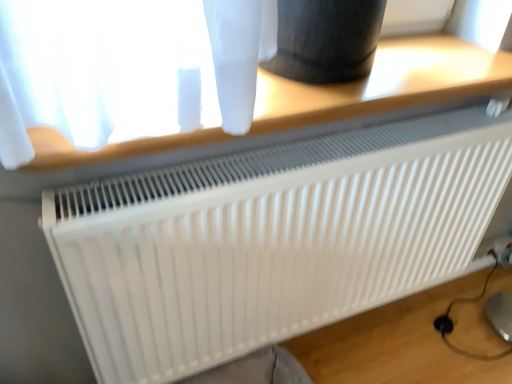
Question: Is white plastic table at upper center wider or thinner than white matte radiator at center?

Choices:
 (A) wide
 (B) thin

Answer: (A)

Question: From a real-world perspective, is white plastic table at upper center positioned above or below white matte radiator at center?

Choices:
 (A) above
 (B) below

Answer: (A)

Question: Considering the positions of white plastic table at upper center and white matte radiator at center in the image, is white plastic table at upper center bigger or smaller than white matte radiator at center?

Choices:
 (A) big
 (B) small

Answer: (B)

Question: Is white matte radiator at center taller or shorter than white plastic table at upper center?

Choices:
 (A) short
 (B) tall

Answer: (B)

Question: Looking at the image, does white matte radiator at center seem bigger or smaller compared to white plastic table at upper center?

Choices:
 (A) big
 (B) small

Answer: (A)

Question: From a real-world perspective, relative to white plastic table at upper center, is white matte radiator at center vertically above or below?

Choices:
 (A) below
 (B) above

Answer: (A)

Question: From the image's perspective, is white matte radiator at center located above or below white plastic table at upper center?

Choices:
 (A) above
 (B) below

Answer: (B)